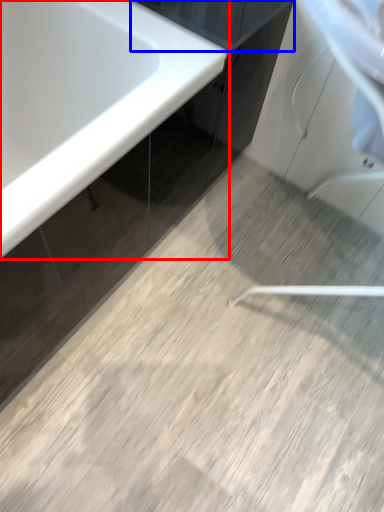
Question: Which object is closer to the camera taking this photo, bathtub (highlighted by a red box) or cabinetry (highlighted by a blue box)?

Choices:
 (A) bathtub
 (B) cabinetry

Answer: (A)